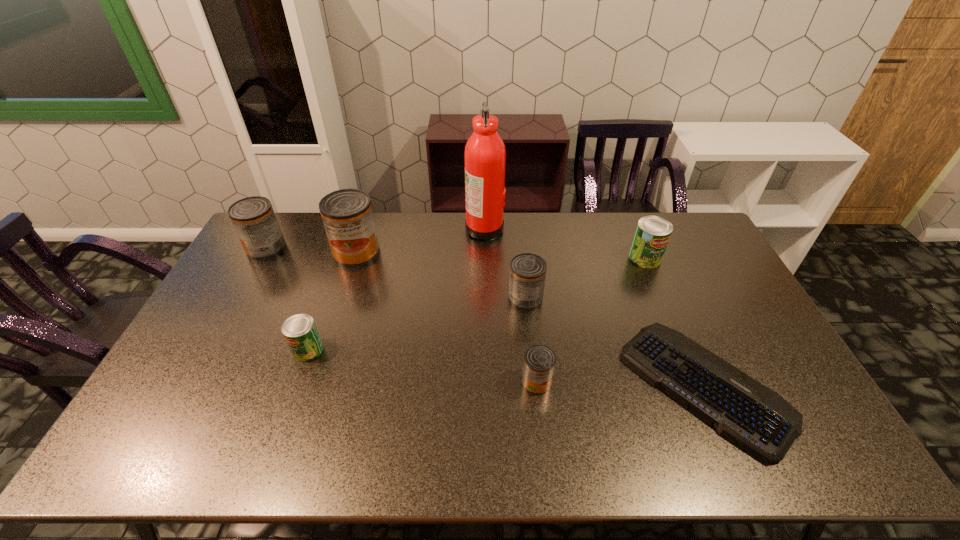
Locate an element on the screen. This screenshot has height=540, width=960. fire extinguisher is located at coordinates (485, 155).

Identify the location of the second red can from left to right. This screenshot has height=540, width=960. (347, 215).

You are a GUI agent. You are given a task and a screenshot of the screen. Output one action in this format:
    pyautogui.click(x=<x>, y=<y>)
    Task: Click on the tallest can
    Image resolution: width=960 pixels, height=540 pixels.
    Given the screenshot: What is the action you would take?
    pyautogui.click(x=347, y=215)

Find the location of `the second tallest can`. the second tallest can is located at coordinates (254, 219).

The height and width of the screenshot is (540, 960). I want to click on the leftmost can, so click(254, 219).

You are a GUI agent. You are given a task and a screenshot of the screen. Output one action in this format:
    pyautogui.click(x=<x>, y=<y>)
    Task: Click on the farther green can
    This screenshot has width=960, height=540.
    Given the screenshot: What is the action you would take?
    pyautogui.click(x=652, y=235)

Where is `the right green can`? The height and width of the screenshot is (540, 960). the right green can is located at coordinates (652, 235).

The image size is (960, 540). In order to click on the second nearest red can in this screenshot , I will do 527,271.

Where is `the second smallest red can`? The height and width of the screenshot is (540, 960). the second smallest red can is located at coordinates (527, 271).

Identify the location of the second nearest can. This screenshot has width=960, height=540. (x=300, y=332).